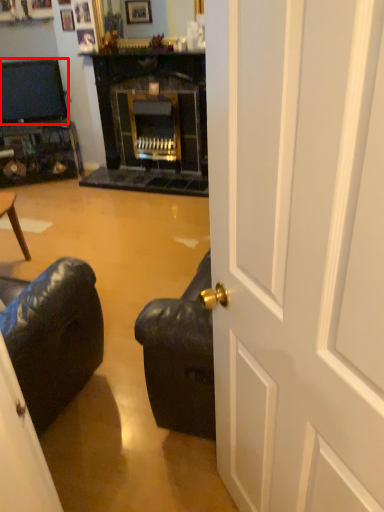
Question: From the image's perspective, considering the relative positions of television (annotated by the red box) and door in the image provided, where is television (annotated by the red box) located with respect to the staircase?

Choices:
 (A) above
 (B) below

Answer: (A)